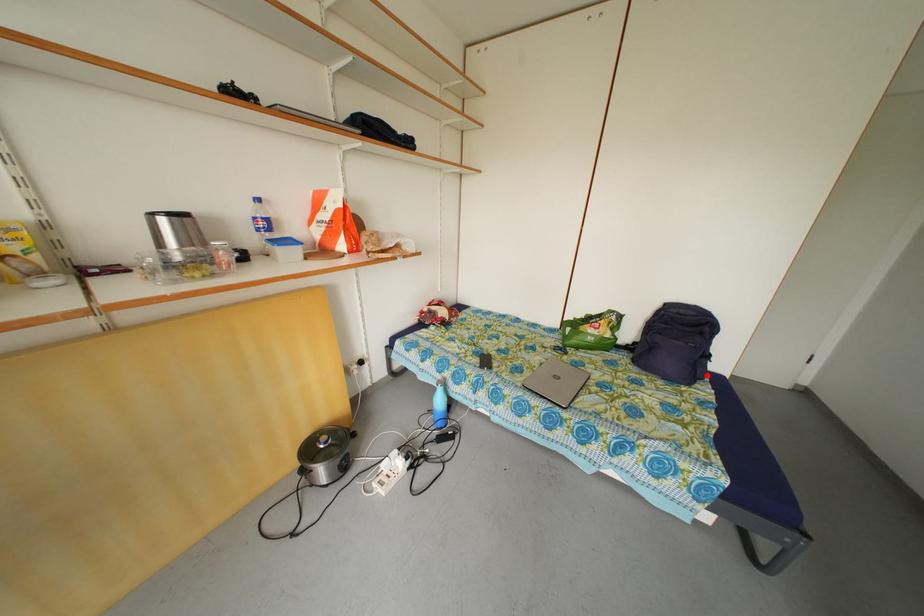
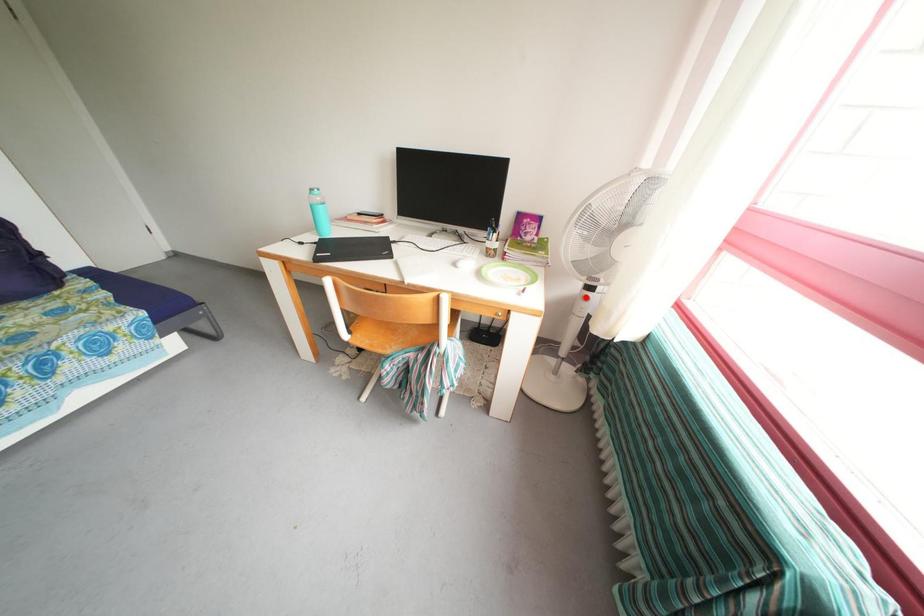
I am providing you with two images of the same scene from different viewpoints. A red point is marked on the first image and another point is marked on the second image. Do the highlighted points in image1 and image2 indicate the same real-world spot?

No